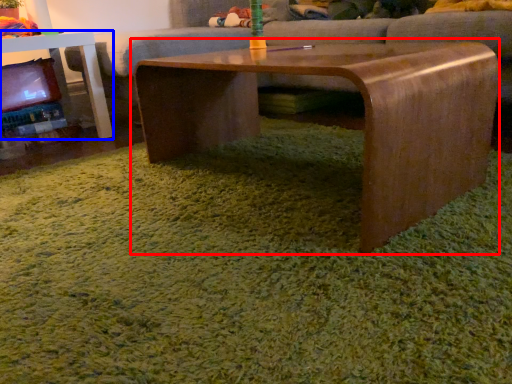
Question: Which object appears closest to the camera in this image, coffee table (highlighted by a red box) or table (highlighted by a blue box)?

Choices:
 (A) coffee table
 (B) table

Answer: (A)